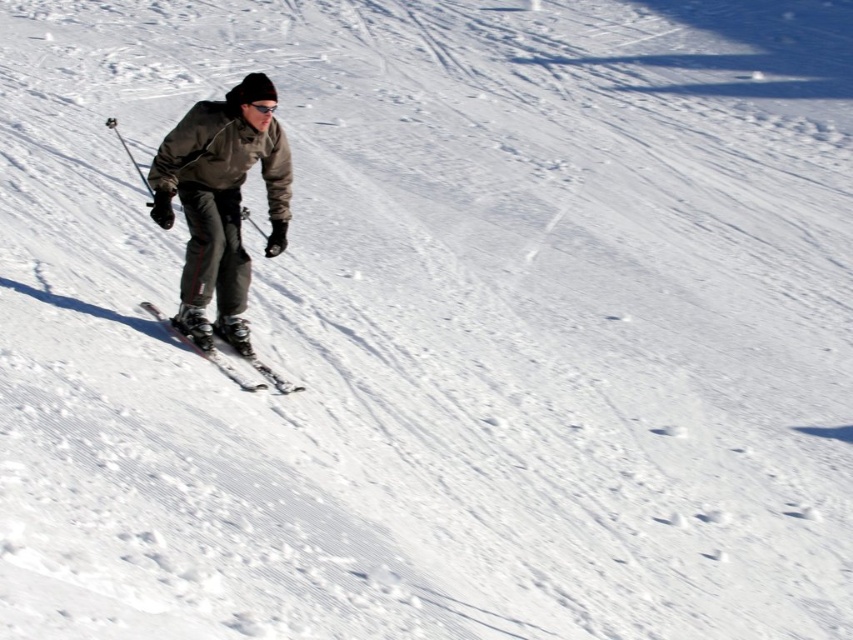
You are a photographer positioned at the origin of the coordinate system. You want to capture the gray softshell jacket at center in your photo. What are the coordinates where you should aim your camera to ensure the jacket is centered in the frame?

The coordinates to aim the camera are at point (221,202) to center the gray softshell jacket at center in the frame.

You are a photographer trying to capture the skier in the image. From your perspective, which object, the gray softshell jacket at center or the metallic skis at center, appears larger in the photo?

The gray softshell jacket at center appears larger because it is taller than the metallic skis at center.

You are a photographer positioned at the bottom of the slope. You want to capture a photo of the gray softshell jacket at center and metallic skis at center. Based on their positions, which object will appear closer to the front of the photo?

The gray softshell jacket at center is in front of the metallic skis at center, so it will appear closer to the front of the photo.